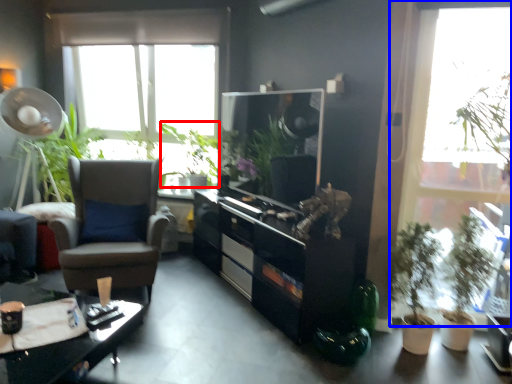
Question: Which point is further to the camera, vegetation (highlighted by a red box) or window (highlighted by a blue box)?

Choices:
 (A) vegetation
 (B) window

Answer: (A)